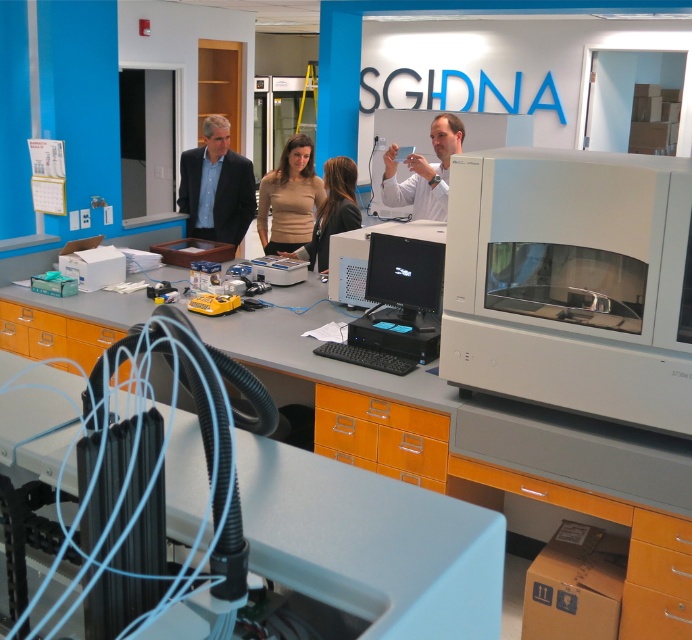
You are setting up a display in the lab and need to arrange the matte black monitor at center and the matte beige sweater at center side by side. Given their widths, which item should be placed first to ensure they fit properly?

The matte black monitor at center has a smaller width than the matte beige sweater at center, so you should place the matte beige sweater at center first to accommodate its larger size, then position the matte black monitor at center next to it.

In the laboratory scene, there is a point marked at coordinates (382, 435). What object is located at this point?

The point at coordinates (382, 435) indicates the orange matte file cabinet at lower center.